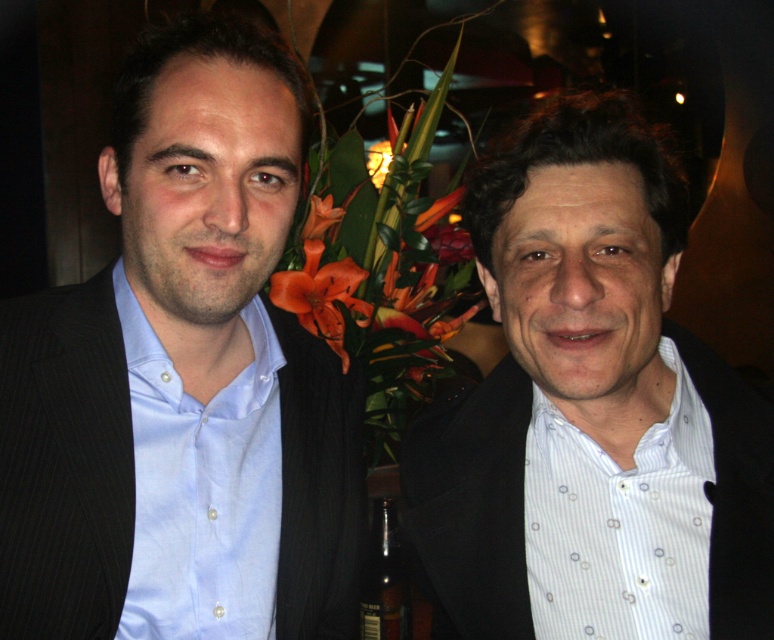
You are a photographer standing at point (272,72). You need to take a photo of the two people in the scene. Can you fit both of them in the frame if your camera has a 50mm lens?

The two people are 26.84 inches apart. With a 50mm lens, the field of view is approximately 46 degrees, which can capture subjects within a reasonable distance. Since 26.84 inches is a moderate distance, both individuals can likely fit within the frame.

You are a photographer setting up for a group photo. You need to position the matte black suit at left and the white textured shirt at center so that both fit within a 1.2 meter wide frame. Given their widths, will they fit side by side without overlapping?

The matte black suit at left is wider than the white textured shirt at center. Since the total width of both objects exceeds 1.2 meters, they will not fit side by side within the frame without overlapping.

You are a photographer setting up for a group photo. You notice the matte black suit at left and the white textured shirt at center. Which object is covering part of the other?

The matte black suit at left is positioned over the white textured shirt at center, so it is covering part of it.